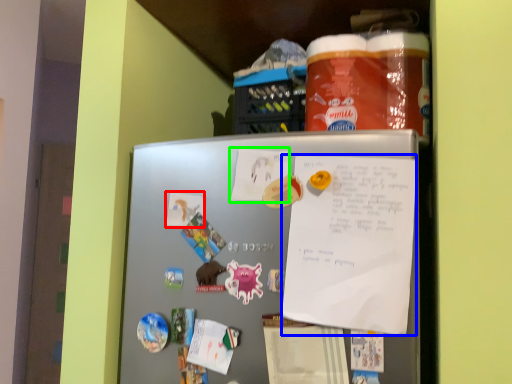
Question: Based on their relative distances, which object is nearer to paper (highlighted by a red box)? Choose from poster (highlighted by a blue box) and paper (highlighted by a green box).

Choices:
 (A) poster
 (B) paper

Answer: (B)